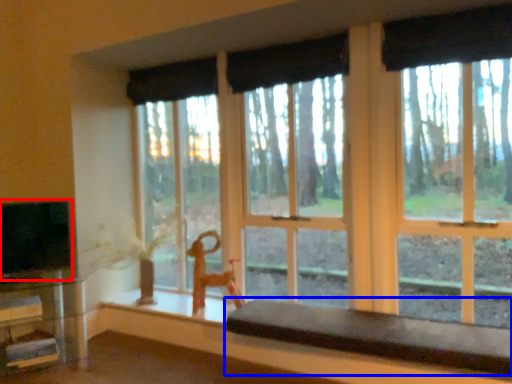
Question: Which point is closer to the camera, level (highlighted by a red box) or table (highlighted by a blue box)?

Choices:
 (A) level
 (B) table

Answer: (B)